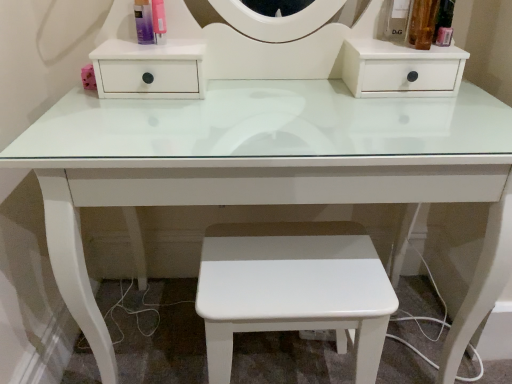
Question: In terms of width, does white glossy stool at center look wider or thinner when compared to matte plastic spray at upper left?

Choices:
 (A) wide
 (B) thin

Answer: (A)

Question: In the image, is white glossy stool at center on the left side or the right side of matte plastic spray at upper left?

Choices:
 (A) right
 (B) left

Answer: (A)

Question: Does point (248, 256) appear closer or farther from the camera than point (143, 23)?

Choices:
 (A) closer
 (B) farther

Answer: (A)

Question: From a real-world perspective, is matte plastic spray at upper left positioned above or below white glossy stool at center?

Choices:
 (A) below
 (B) above

Answer: (B)

Question: Visually, is matte plastic spray at upper left positioned to the left or to the right of white glossy stool at center?

Choices:
 (A) left
 (B) right

Answer: (A)

Question: From the image's perspective, relative to white glossy stool at center, is matte plastic spray at upper left above or below?

Choices:
 (A) below
 (B) above

Answer: (B)

Question: Considering their positions, is matte plastic spray at upper left located in front of or behind white glossy stool at center?

Choices:
 (A) front
 (B) behind

Answer: (B)